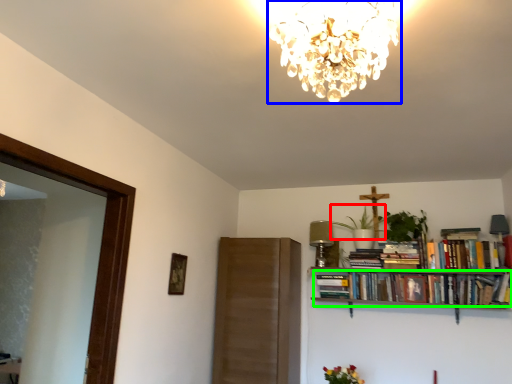
Question: Which is nearer to the plant (highlighted by a red box)? lamp (highlighted by a blue box) or book (highlighted by a green box).

Choices:
 (A) lamp
 (B) book

Answer: (B)